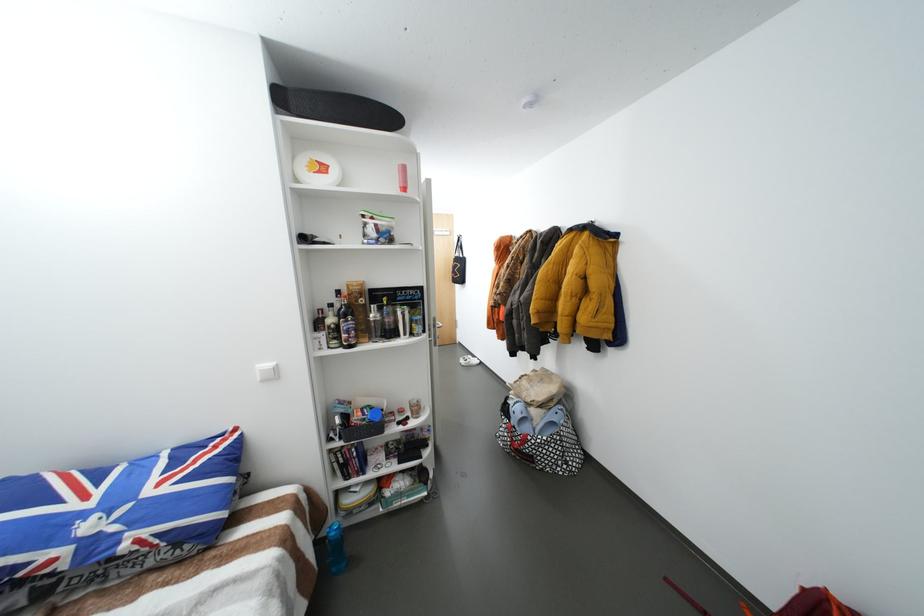
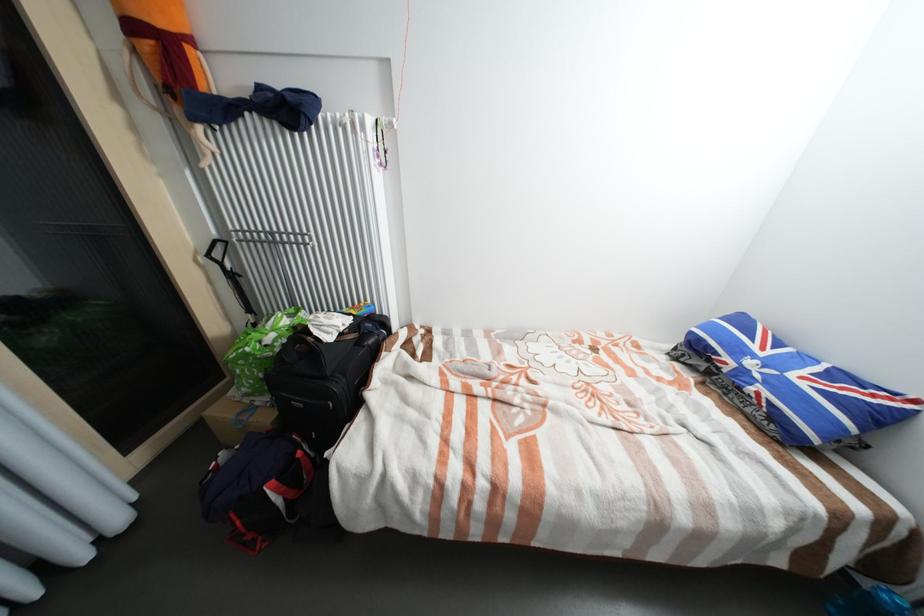
The images are taken continuously from a first-person perspective. In which direction is your viewpoint rotating?

The rotation direction of the camera is left-down.